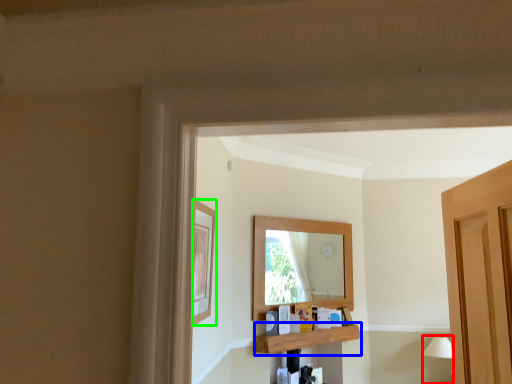
Question: Which is nearer to the lamp (highlighted by a red box)? shelf (highlighted by a blue box) or picture frame (highlighted by a green box).

Choices:
 (A) shelf
 (B) picture frame

Answer: (A)